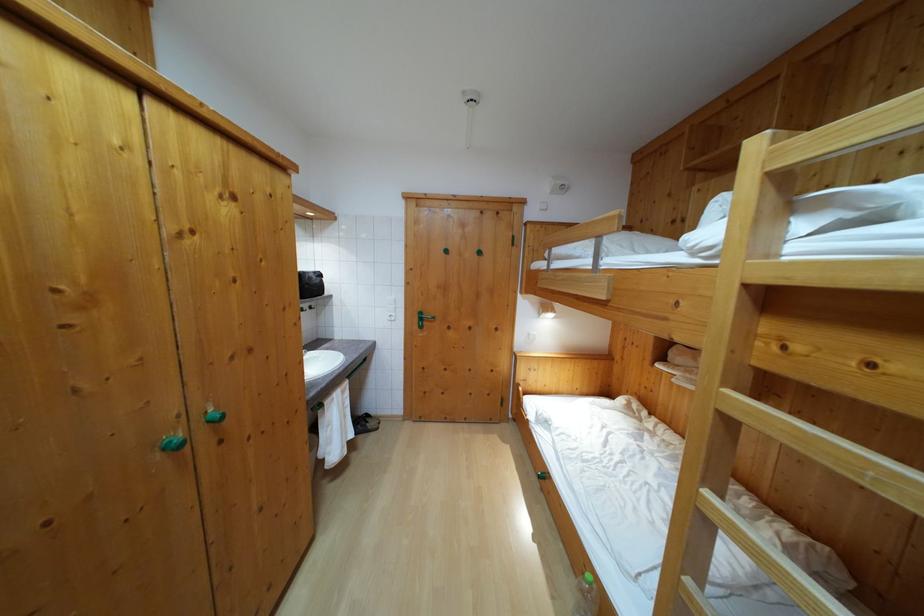
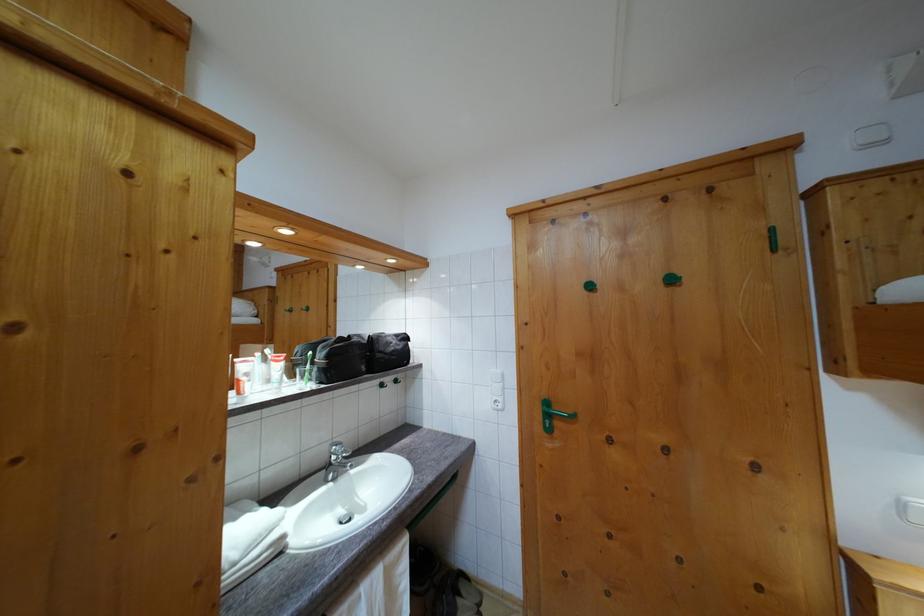
In the second image, find the point that corresponds to point (483, 260) in the first image.

(675, 286)